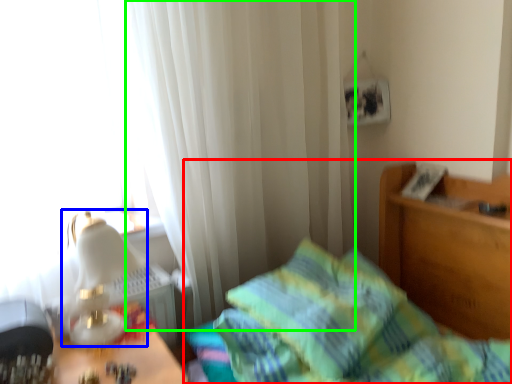
Question: Considering the real-world distances, which object is farthest from bed (highlighted by a red box)? table lamp (highlighted by a blue box) or curtain (highlighted by a green box)?

Choices:
 (A) table lamp
 (B) curtain

Answer: (A)